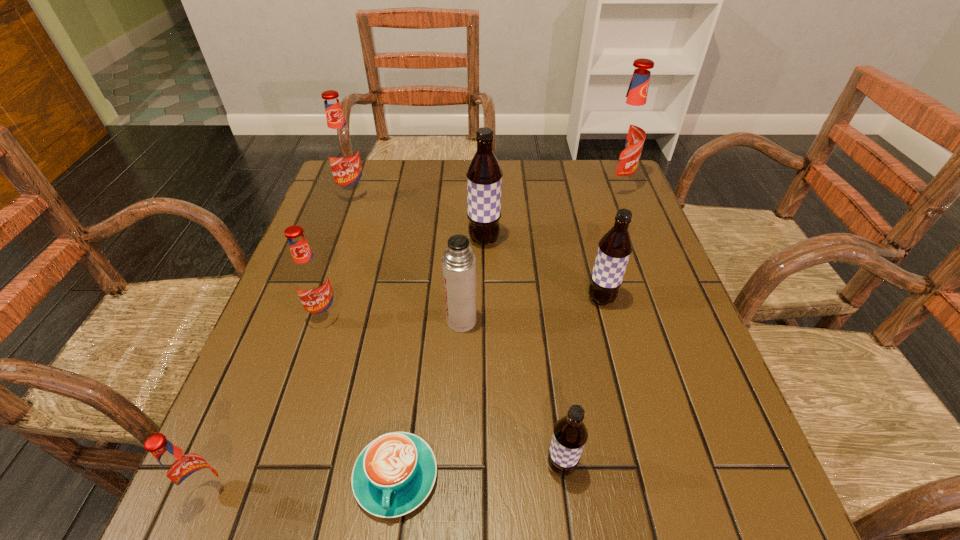
Where is `free point between the rightmost root beer and the smallest brown root beer`? The image size is (960, 540). free point between the rightmost root beer and the smallest brown root beer is located at coordinates (588, 327).

The image size is (960, 540). Find the location of `free space between the biggest brown root beer and the second biggest red root beer`. free space between the biggest brown root beer and the second biggest red root beer is located at coordinates pyautogui.click(x=419, y=218).

This screenshot has height=540, width=960. In order to click on vacant space that's between the thermos bottle and the sixth root beer from left to right in this screenshot , I will do `click(531, 310)`.

Find the location of a particular element. Image resolution: width=960 pixels, height=540 pixels. free space between the smallest red root beer and the thermos bottle is located at coordinates (336, 407).

Locate an element on the screen. empty space that is in between the third smallest red root beer and the thermos bottle is located at coordinates (408, 258).

The image size is (960, 540). What are the coordinates of `unoccupied position between the second smallest brown root beer and the thermos bottle` in the screenshot? It's located at (531, 310).

Where is `free space between the second biggest red root beer and the smallest red root beer`? free space between the second biggest red root beer and the smallest red root beer is located at coordinates (282, 345).

In order to click on object identified as the seventh closest to the third root beer from right to left in this screenshot , I will do `click(627, 131)`.

Locate an element on the screen. The height and width of the screenshot is (540, 960). the second closest object to the cappuccino is located at coordinates (187, 472).

Point out which root beer is positioned as the sixth nearest to the cappuccino. Please provide its 2D coordinates. Your answer should be formatted as a tuple, i.e. [(x, y)], where the tuple contains the x and y coordinates of a point satisfying the conditions above.

[(342, 149)]